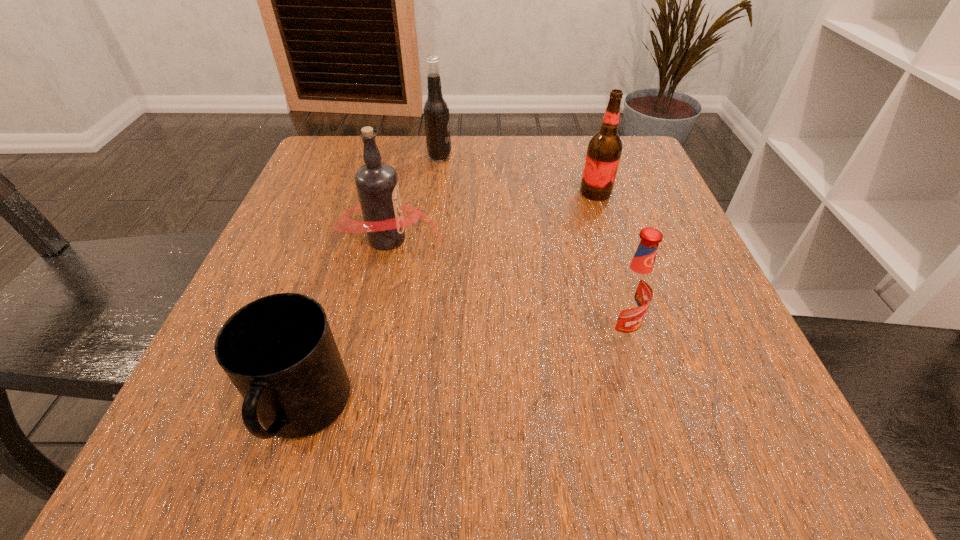
I want to click on vacant space that's between the third nearest object and the shortest object, so click(346, 325).

This screenshot has height=540, width=960. Find the location of `vacant area that lies between the third farthest object and the nearest object`. vacant area that lies between the third farthest object and the nearest object is located at coordinates (346, 325).

You are a GUI agent. You are given a task and a screenshot of the screen. Output one action in this format:
    pyautogui.click(x=<x>, y=<y>)
    Task: Click on the empty space between the second nearest object and the third nearest object
    
    Given the screenshot: What is the action you would take?
    pyautogui.click(x=503, y=287)

Image resolution: width=960 pixels, height=540 pixels. Find the location of `object that stands as the second closest to the shortest object`. object that stands as the second closest to the shortest object is located at coordinates (632, 290).

Choose which object is the second nearest neighbor to the nearest object. Please provide its 2D coordinates. Your answer should be formatted as a tuple, i.e. [(x, y)], where the tuple contains the x and y coordinates of a point satisfying the conditions above.

[(632, 290)]

You are a GUI agent. You are given a task and a screenshot of the screen. Output one action in this format:
    pyautogui.click(x=<x>, y=<y>)
    Task: Click on the root beer that is the second closest to the nearest root beer
    Image resolution: width=960 pixels, height=540 pixels.
    Given the screenshot: What is the action you would take?
    pyautogui.click(x=604, y=150)

This screenshot has height=540, width=960. In order to click on root beer that can be found as the second closest to the nearest root beer in this screenshot , I will do `click(604, 150)`.

Find the location of a particular element. free space that satisfies the following two spatial constraints: 1. on the label of the second farthest object; 2. on the right side of the farthest root beer is located at coordinates (435, 192).

Where is `vacant space that satisfies the following two spatial constraints: 1. on the label of the nearest root beer; 2. on the left side of the third farthest root beer`? This screenshot has width=960, height=540. vacant space that satisfies the following two spatial constraints: 1. on the label of the nearest root beer; 2. on the left side of the third farthest root beer is located at coordinates (368, 335).

Locate an element on the screen. The image size is (960, 540). vacant point that satisfies the following two spatial constraints: 1. on the label of the third farthest object; 2. on the right side of the fourth farthest object is located at coordinates (368, 335).